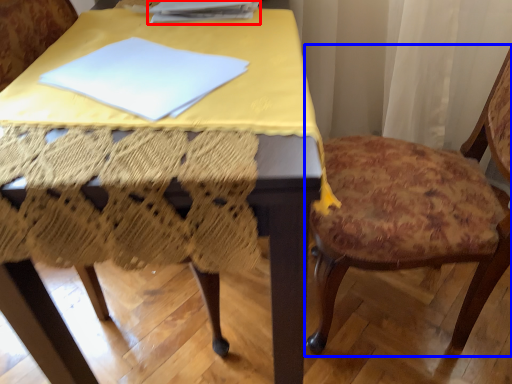
Question: Which point is further to the camera, paperback book (highlighted by a red box) or chair (highlighted by a blue box)?

Choices:
 (A) paperback book
 (B) chair

Answer: (A)